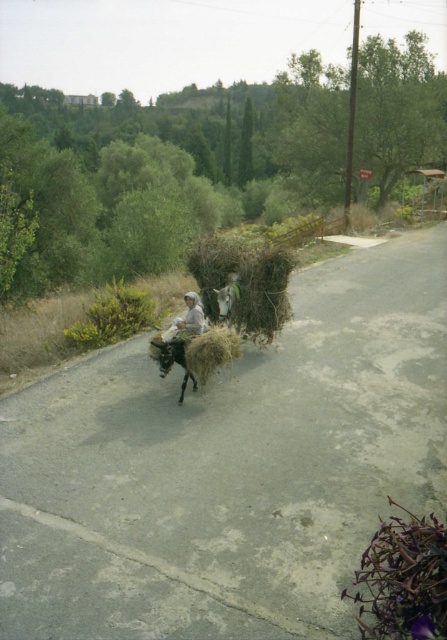
You are a traveler approaching the light beige fabric at center and the brown fuzzy donkey at center. Which object will you encounter first?

The light beige fabric at center is closer to the viewer than the brown fuzzy donkey at center, so you will encounter the light beige fabric at center first.